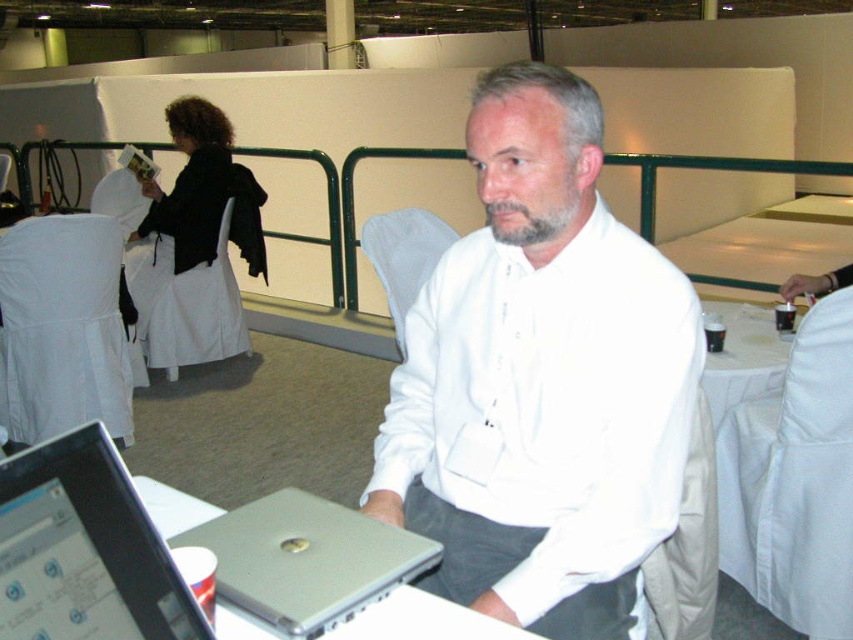
You are organizing a small event and need to decide whether the white matte shirt at center can be fully covered by the white cloth at right. Based on their sizes, what would you advise?

The white matte shirt at center is wider than the white cloth at right, so the cloth cannot fully cover the shirt.

You are standing in the conference room and want to hand a document to the man. Which object, the white matte shirt at center or the silver metallic laptop at lower left, is closer to you so you can reach it first?

→ The white matte shirt at center is closer to you than the silver metallic laptop at lower left, so you can reach it first.